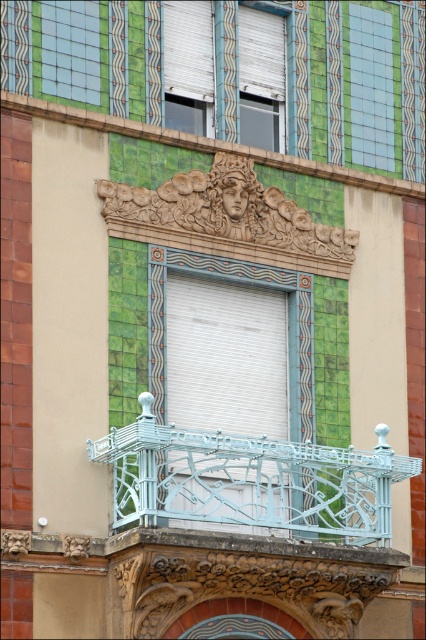
You are standing in front of the building and see two points on the facade labeled as point (365,40) and point (245,118). Which point is closer to you?

Point (365,40) is further to the camera than point (245,118), so the point closer to you is point (245,118).

You are an architect examining the building facade. You notice the green tile at upper right and the white matte window at upper center. Which object is positioned to the right side of the other?

The green tile at upper right is to the right of the white matte window at upper center.

You are standing in front of the building and notice two points marked on the facade. The first point is at coordinates point(166, 214) and the second is at point(377, 26). Which point is closer to you?

Point(166, 214) is closer to the viewer than point(377, 26).